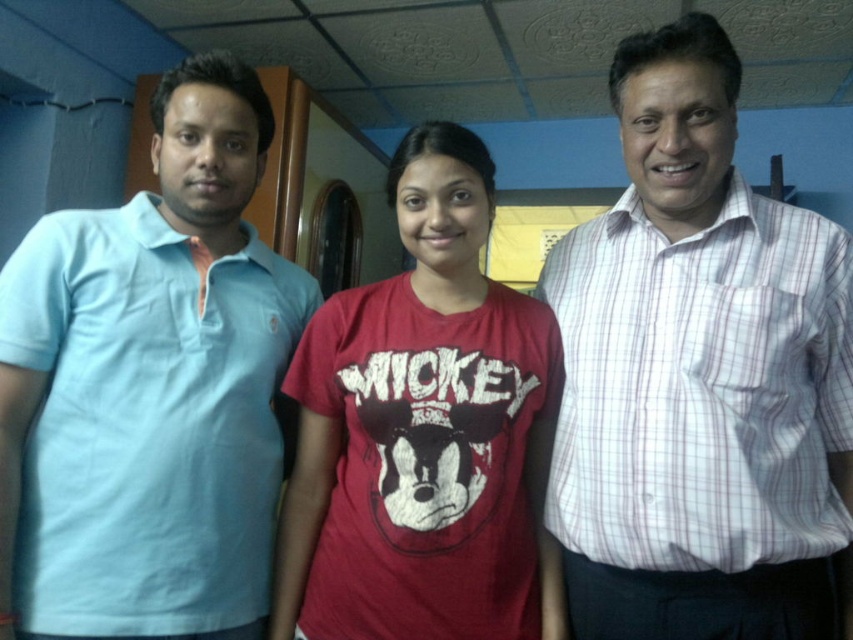
Which of these two, red matte t-shirt at center or white checkered shirt at right, stands shorter?

white checkered shirt at right

Who is higher up, red matte t-shirt at center or white checkered shirt at right?

white checkered shirt at right is above.

In order to click on red matte t-shirt at center in this screenshot , I will do `click(424, 433)`.

Identify the location of red matte t-shirt at center. (424, 433).

Which is in front, point (138, 262) or point (729, 268)?

Point (729, 268) is in front.

Does light blue cotton polo shirt at left appear under white checkered shirt at right?

Incorrect, light blue cotton polo shirt at left is not positioned below white checkered shirt at right.

Is point (131, 468) farther from camera compared to point (785, 451)?

Yes.

Find the location of a particular element. light blue cotton polo shirt at left is located at coordinates (149, 388).

Consider the image. Which is below, light blue cotton polo shirt at left or red matte t-shirt at center?

red matte t-shirt at center is below.

Is point (236, 301) less distant than point (364, 614)?

No, it is behind (364, 614).

Where is `light blue cotton polo shirt at left`? The image size is (853, 640). light blue cotton polo shirt at left is located at coordinates (149, 388).